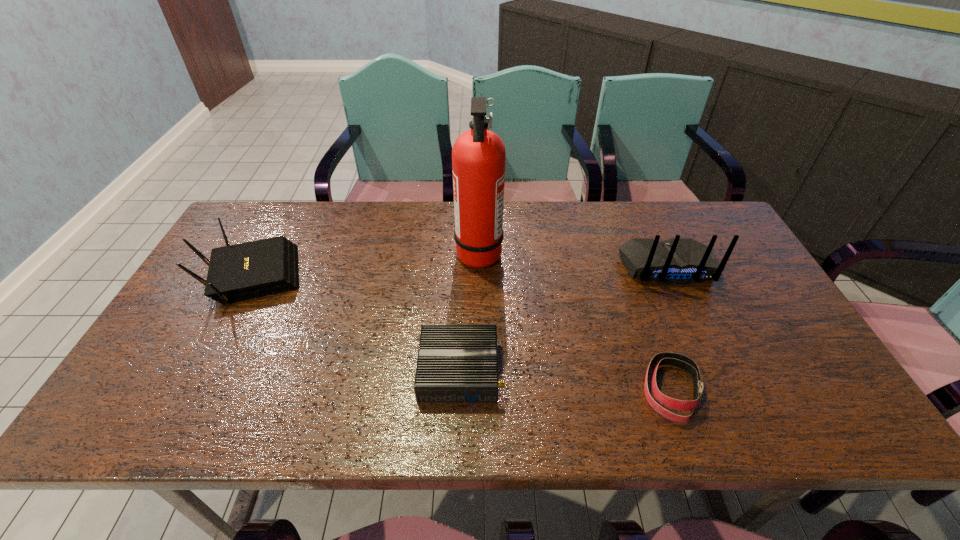
This screenshot has width=960, height=540. What are the coordinates of `unoccupied position between the second tallest object and the second shortest router` in the screenshot? It's located at (459, 272).

At what (x,y) coordinates should I click in order to perform the action: click on free spot between the tallest object and the dog collar. Please return your answer as a coordinate pair (x, y). The image size is (960, 540). Looking at the image, I should click on (575, 321).

The width and height of the screenshot is (960, 540). I want to click on object that is the fourth closest one to the fire extinguisher, so click(244, 271).

Select which object appears as the closest to the third tallest object. Please provide its 2D coordinates. Your answer should be formatted as a tuple, i.e. [(x, y)], where the tuple contains the x and y coordinates of a point satisfying the conditions above.

[(456, 362)]

You are a GUI agent. You are given a task and a screenshot of the screen. Output one action in this format:
    pyautogui.click(x=<x>, y=<y>)
    Task: Click on the second closest router to the rightmost router
    The height and width of the screenshot is (540, 960).
    Given the screenshot: What is the action you would take?
    pyautogui.click(x=244, y=271)

Where is `the closest router to the second shortest router`? the closest router to the second shortest router is located at coordinates (456, 362).

Find the location of a particular element. This screenshot has height=540, width=960. vacant position in the image that satisfies the following two spatial constraints: 1. on the back side of the dog collar; 2. on the handle side of the tallest object is located at coordinates (623, 252).

Where is `blank area in the image that satisfies the following two spatial constraints: 1. on the back panel of the nearest router; 2. on the right side of the dog collar`? blank area in the image that satisfies the following two spatial constraints: 1. on the back panel of the nearest router; 2. on the right side of the dog collar is located at coordinates (459, 389).

Locate an element on the screen. The image size is (960, 540). vacant space that satisfies the following two spatial constraints: 1. on the back panel of the shortest object; 2. on the left side of the nearest router is located at coordinates (459, 389).

Locate an element on the screen. free spot that satisfies the following two spatial constraints: 1. on the back panel of the shortest router; 2. on the right side of the dog collar is located at coordinates (459, 389).